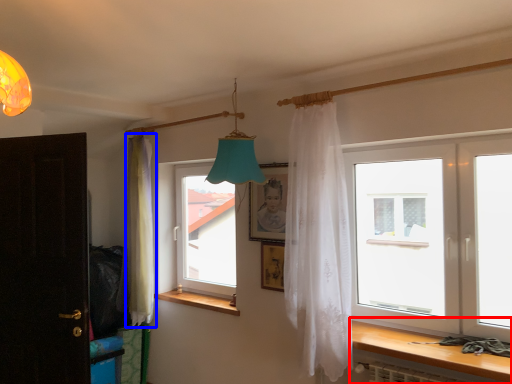
Question: Among these objects, which one is farthest to the camera, table (highlighted by a red box) or curtain (highlighted by a blue box)?

Choices:
 (A) table
 (B) curtain

Answer: (B)